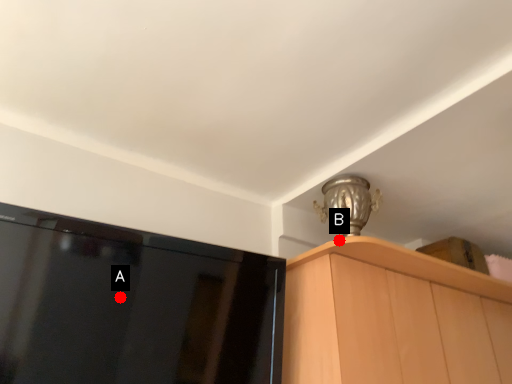
Question: Two points are circled on the image, labeled by A and B beside each circle. Which point is closer to the camera?

Choices:
 (A) A is closer
 (B) B is closer

Answer: (A)